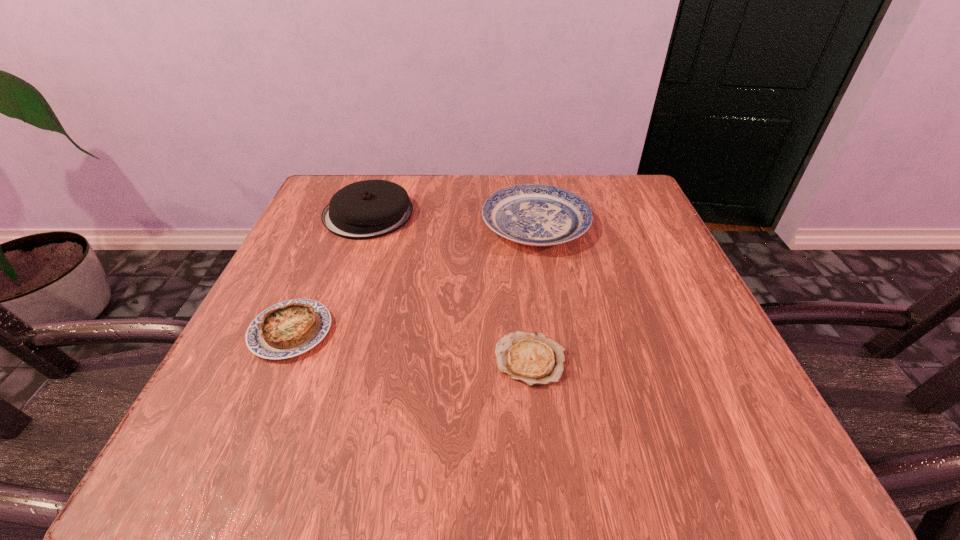
The image size is (960, 540). Identify the location of vacant region between the second tallest object and the right quiche. (533, 292).

The width and height of the screenshot is (960, 540). I want to click on vacant space in between the pancake and the third shortest object, so click(x=452, y=219).

At what (x,y) coordinates should I click in order to perform the action: click on object that is the third closest one to the second tallest object. Please return your answer as a coordinate pair (x, y). Image resolution: width=960 pixels, height=540 pixels. Looking at the image, I should click on (287, 329).

Identify which object is the closest to the plate. Please provide its 2D coordinates. Your answer should be formatted as a tuple, i.e. [(x, y)], where the tuple contains the x and y coordinates of a point satisfying the conditions above.

[(368, 209)]

At what (x,y) coordinates should I click in order to perform the action: click on vacant region that satisfies the following two spatial constraints: 1. on the front side of the third tallest object; 2. on the left side of the shorter quiche. Please return your answer as a coordinate pair (x, y). Image resolution: width=960 pixels, height=540 pixels. Looking at the image, I should click on (278, 360).

Identify the location of vacant space that satisfies the following two spatial constraints: 1. on the front side of the pancake; 2. on the right side of the plate. (365, 225).

I want to click on vacant space that satisfies the following two spatial constraints: 1. on the front side of the right quiche; 2. on the left side of the taller quiche, so click(278, 360).

Identify the location of vacant space that satisfies the following two spatial constraints: 1. on the back side of the shortest object; 2. on the left side of the second tallest object. The image size is (960, 540). (516, 225).